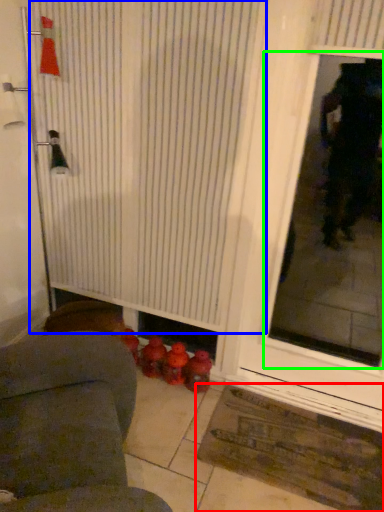
Question: Estimate the real-world distances between objects in this image. Which object is farther from doormat (highlighted by a red box), shower curtain (highlighted by a blue box) or window screen (highlighted by a green box)?

Choices:
 (A) shower curtain
 (B) window screen

Answer: (B)